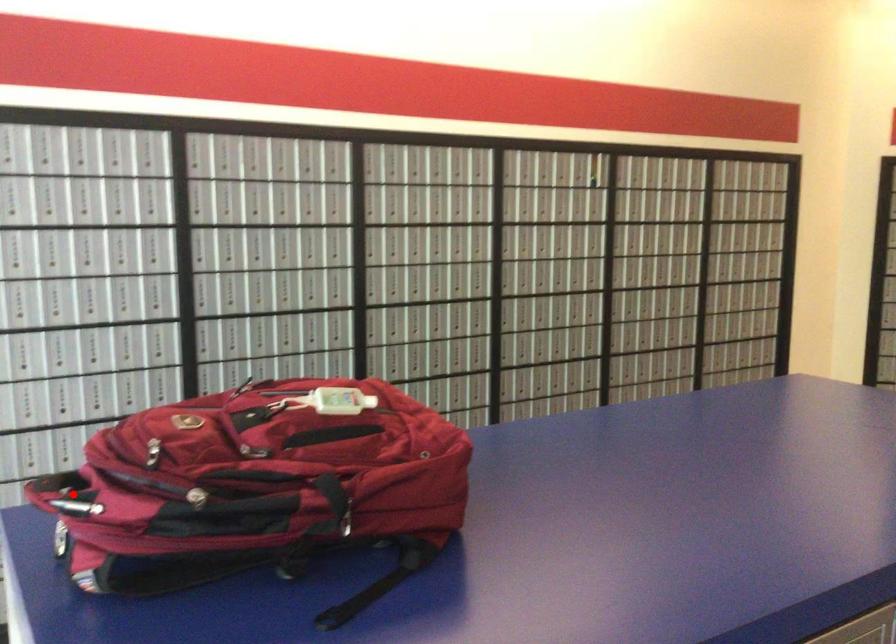
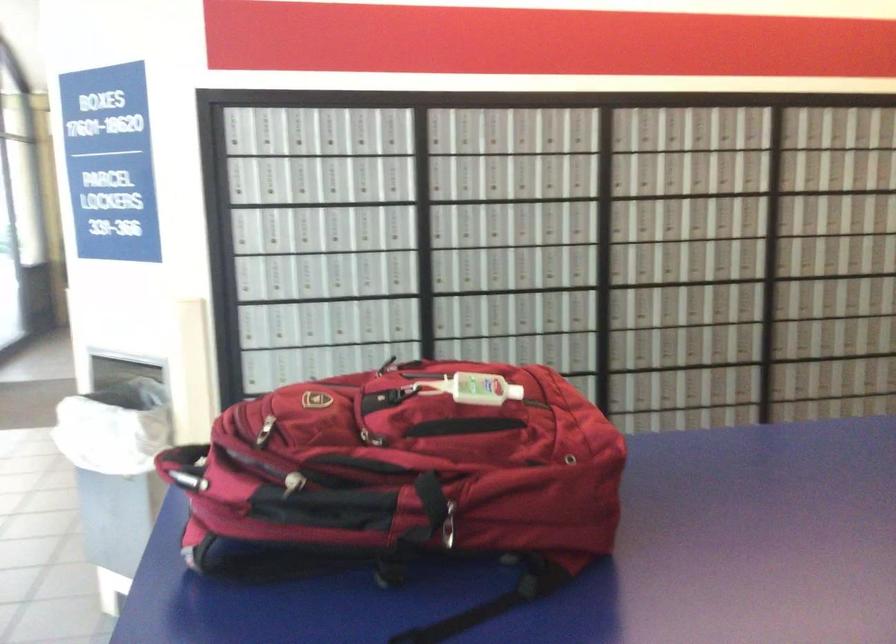
Locate, in the second image, the point that corresponds to the highlighted location in the first image.

(185, 466)